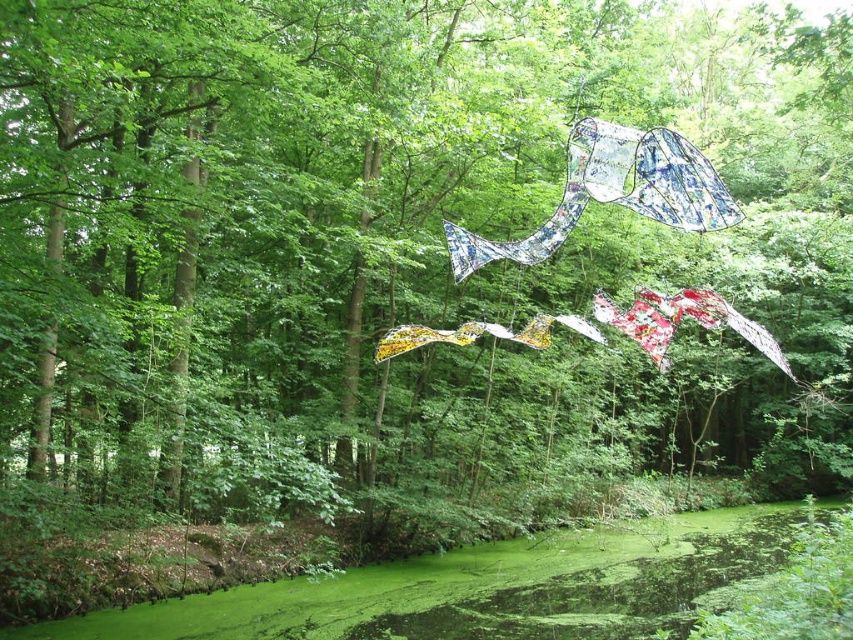
Question: Which point appears closest to the camera in this image?

Choices:
 (A) (726, 538)
 (B) (633, 202)

Answer: (B)

Question: Which point is closer to the camera taking this photo?

Choices:
 (A) (614, 150)
 (B) (283, 588)

Answer: (A)

Question: Which point is closer to the camera?

Choices:
 (A) (293, 582)
 (B) (450, 250)

Answer: (B)

Question: Is green algae-covered water at lower center smaller than recycled plastic kite at center?

Choices:
 (A) no
 (B) yes

Answer: (A)

Question: Can you confirm if green algae-covered water at lower center is positioned above recycled plastic kite at center?

Choices:
 (A) yes
 (B) no

Answer: (B)

Question: Is green algae-covered water at lower center thinner than recycled plastic kite at center?

Choices:
 (A) no
 (B) yes

Answer: (A)